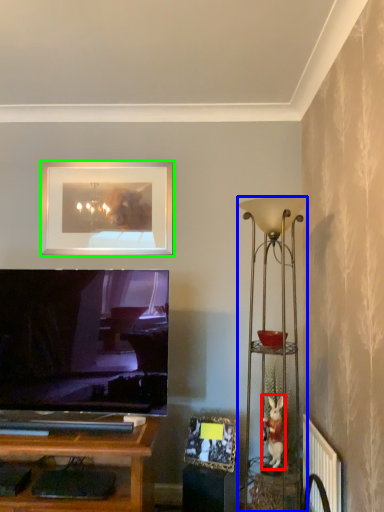
Question: Considering the real-world distances, which object is farthest from toy (highlighted by a red box)? lamp (highlighted by a blue box) or picture frame (highlighted by a green box)?

Choices:
 (A) lamp
 (B) picture frame

Answer: (B)